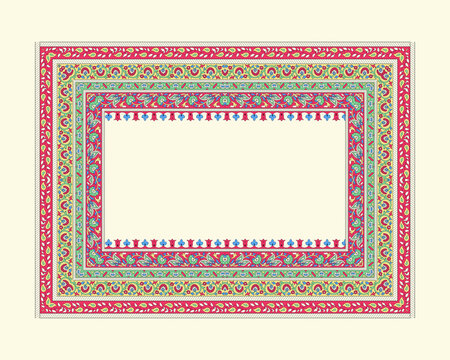
Find the location of a particular element. Image resolution: width=450 pixels, height=360 pixels. bottom left corner of rug is located at coordinates (43, 314).